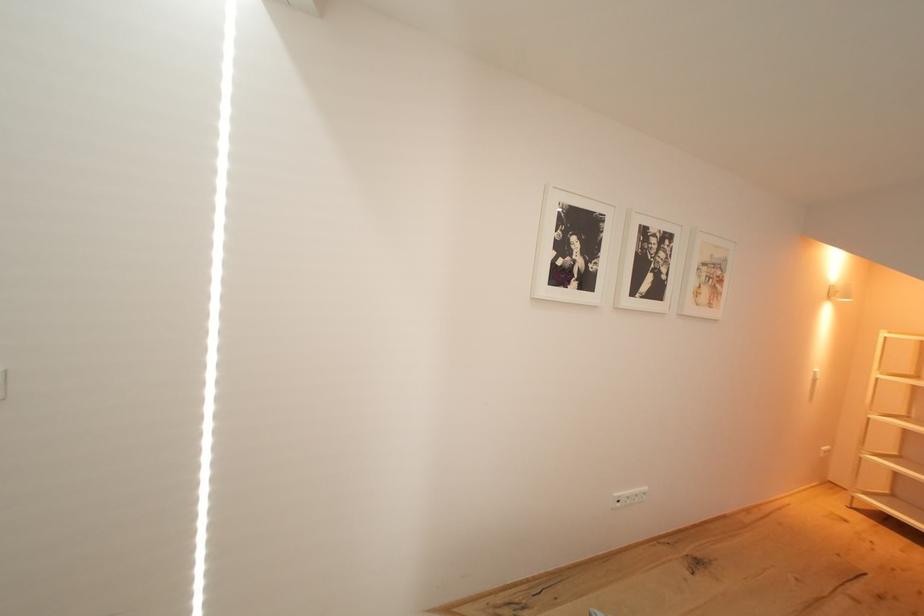
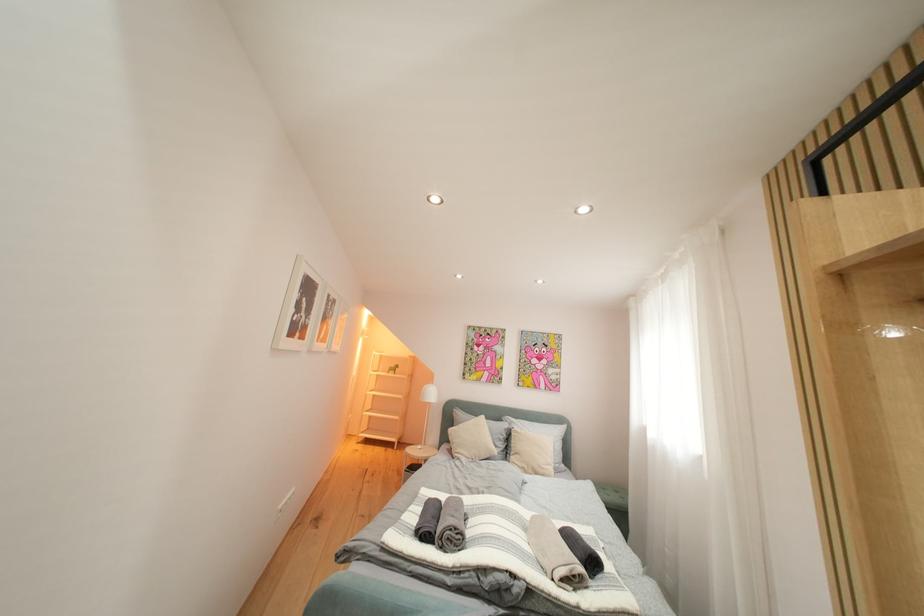
Question: The camera is either moving clockwise (left) or counter-clockwise (right) around the object. The first image is from the beginning of the video and the second image is from the end. Is the camera moving left or right when shooting the video?

Choices:
 (A) Left
 (B) Right

Answer: (A)